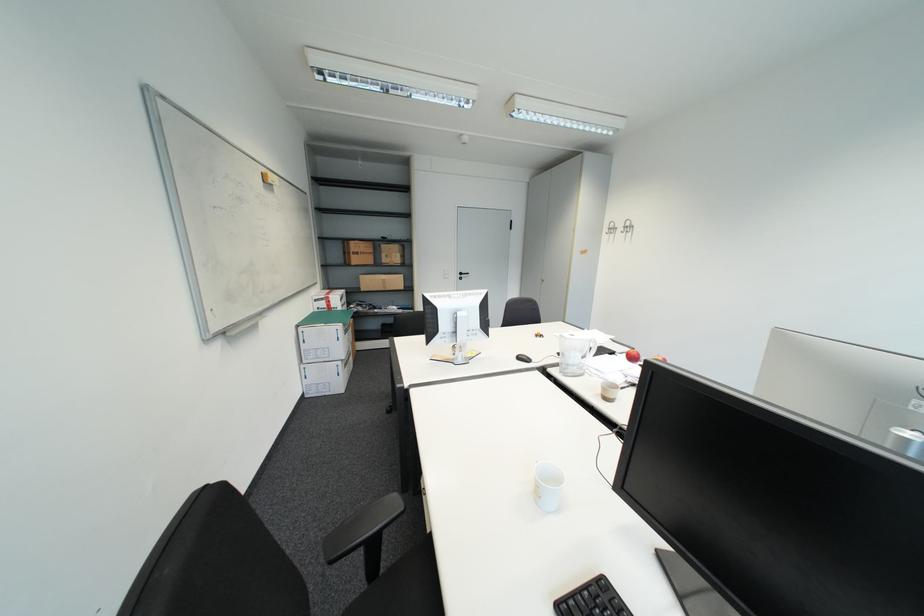
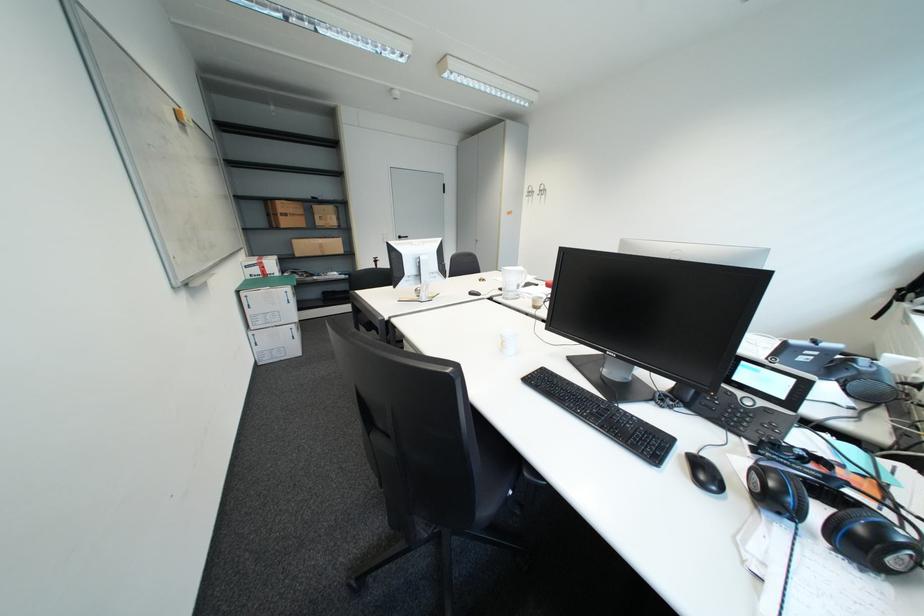
Question: The first image is from the beginning of the video and the second image is from the end. How did the camera likely rotate when shooting the video?

Choices:
 (A) Left
 (B) Right
 (C) Up
 (D) Down

Answer: (B)